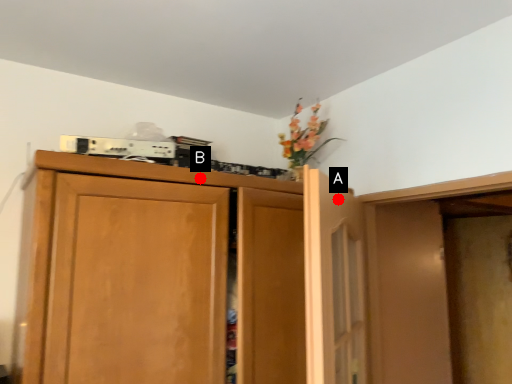
Question: Two points are circled on the image, labeled by A and B beside each circle. Among these points, which one is nearest to the camera?

Choices:
 (A) A is closer
 (B) B is closer

Answer: (A)